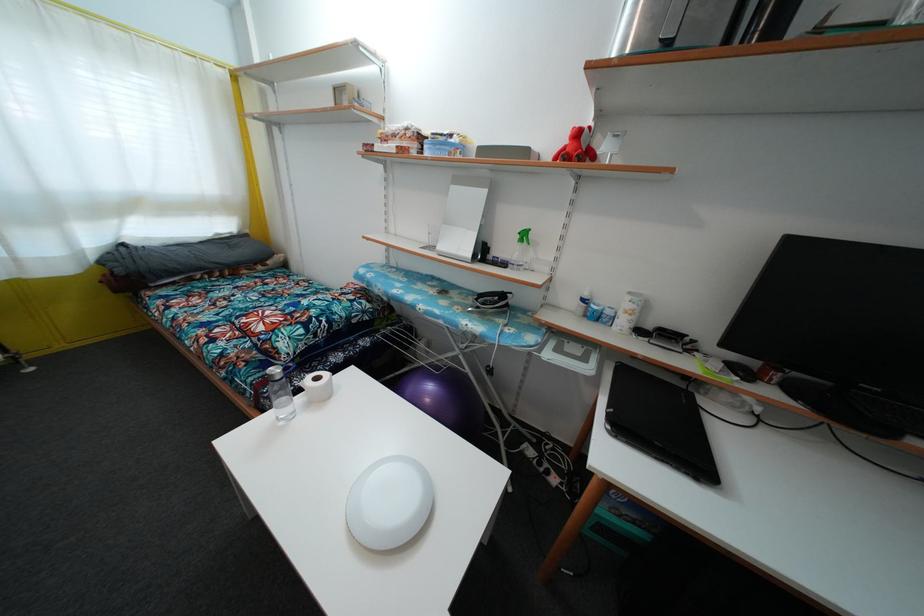
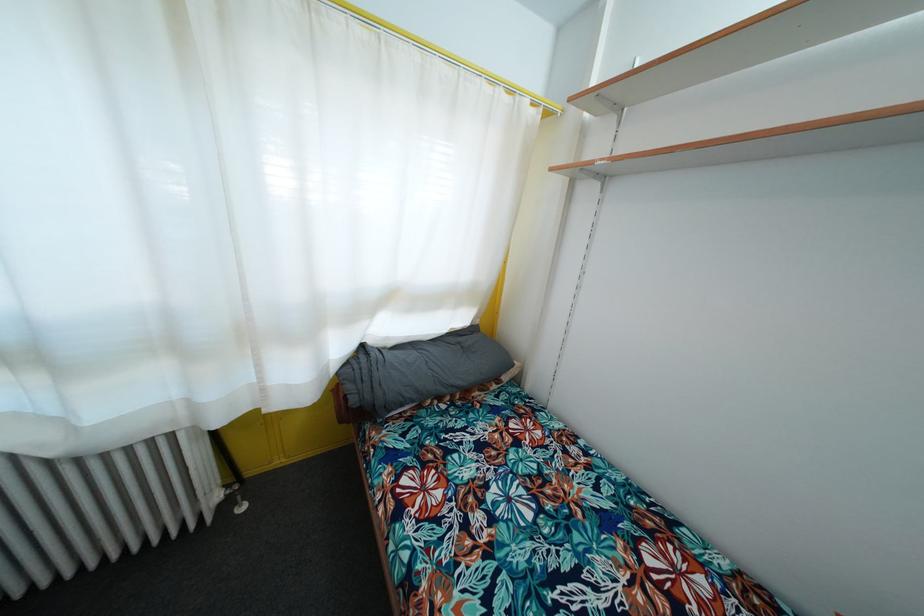
Locate, in the second image, the point that corresponds to (123,278) in the first image.

(358, 407)